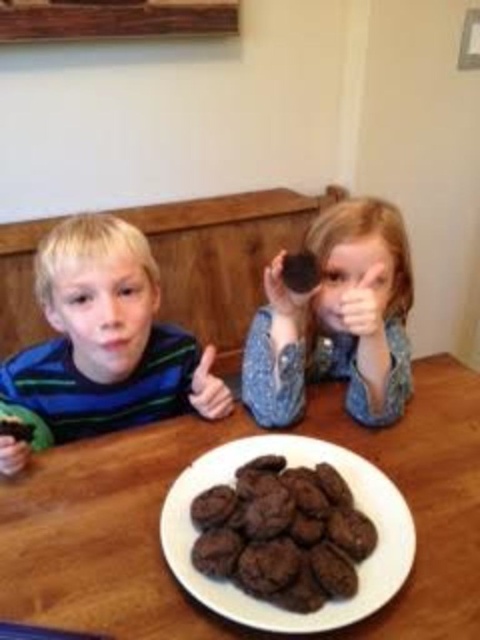
You are standing at the origin of the coordinate system in the image. You want to move towards the point at the bottom right corner of the table. Which point should you move towards first, point (147, 364) or point (26, 458)?

You should move towards point (26, 458) first because it is closer to the bottom right corner of the table than point (147, 364).

You are a photographer taking a picture of the matte blue shirt at left and the matte plastic hand at lower left. Which object will appear closer to the camera in the photo?

The matte plastic hand at lower left will appear closer to the camera in the photo because it is positioned behind the matte blue shirt at left, meaning it is nearer to the camera.